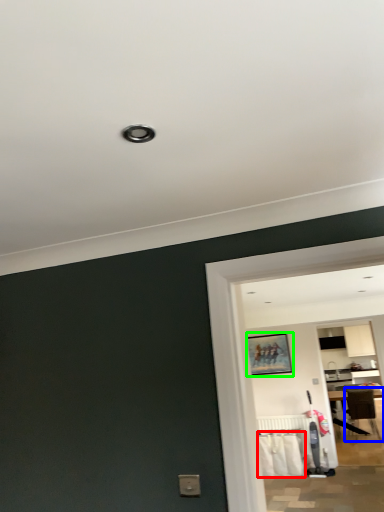
Question: Which object is positioned farthest from laundry (highlighted by a red box)? Select from chair (highlighted by a blue box) and picture frame (highlighted by a green box).

Choices:
 (A) chair
 (B) picture frame

Answer: (A)